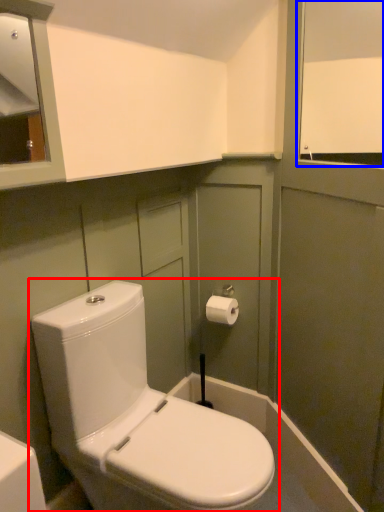
Question: Which of the following is the farthest to the observer, toilet (highlighted by a red box) or window screen (highlighted by a blue box)?

Choices:
 (A) toilet
 (B) window screen

Answer: (B)